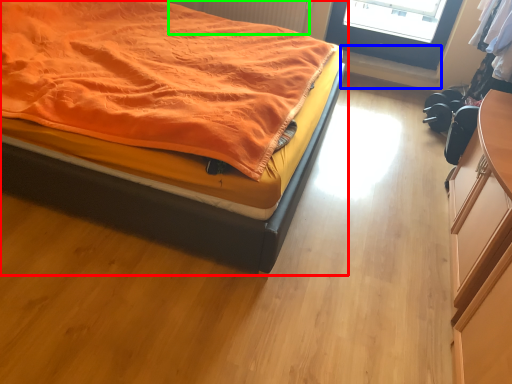
Question: Estimate the real-world distances between objects in this image. Which object is farther from bed (highlighted by a red box), window sill (highlighted by a blue box) or radiator (highlighted by a green box)?

Choices:
 (A) window sill
 (B) radiator

Answer: (A)